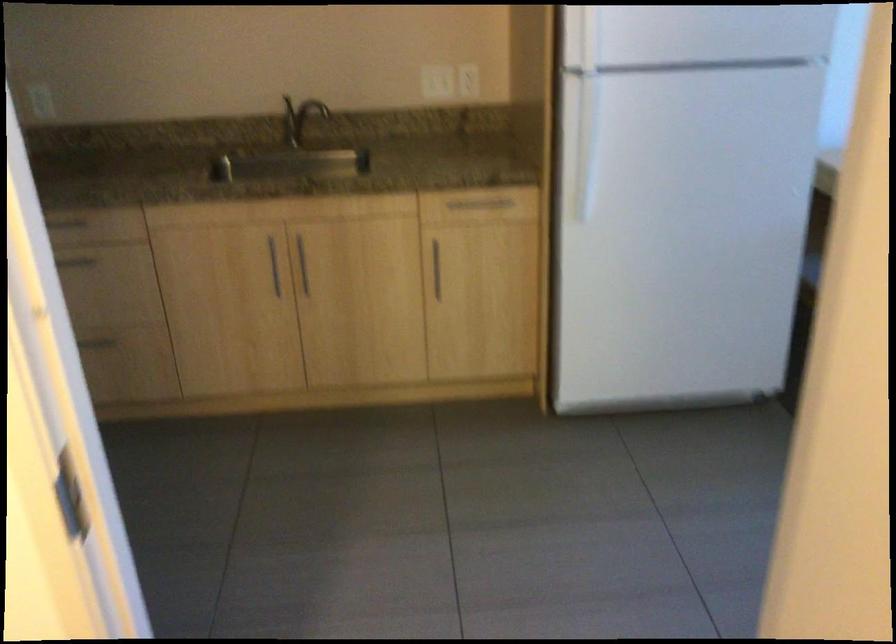
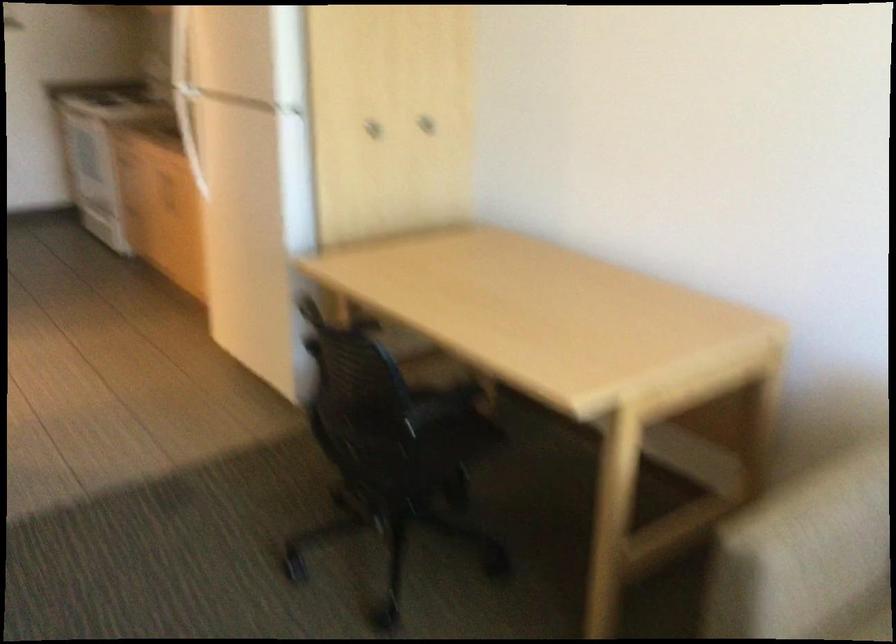
Question: I am providing you with two images of the same scene from different viewpoints. Please identify which objects are invisible in image2.

Choices:
 (A) wall outlet
 (B) chair sitting surface
 (C) refrigerator door handle
 (D) foosball rod handle

Answer: (A)